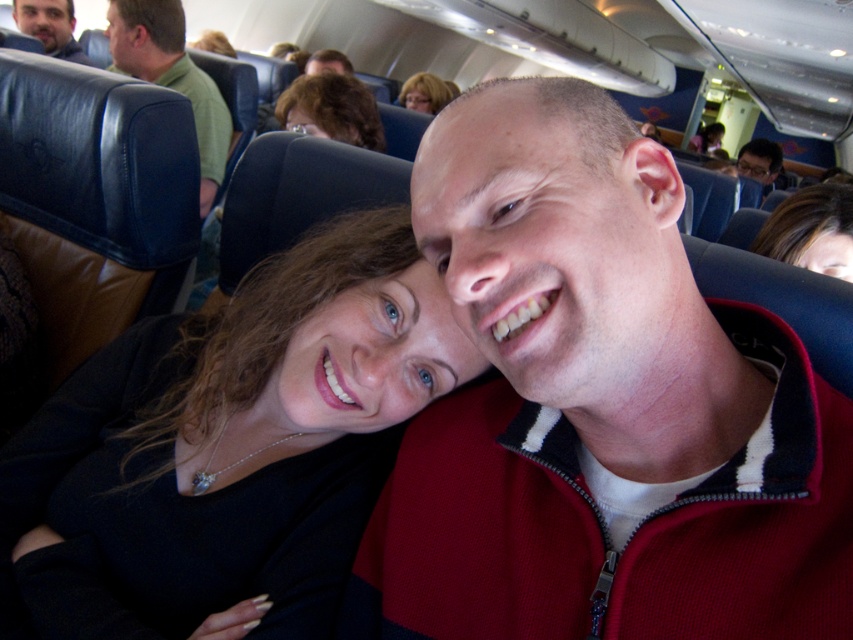
You are a flight attendant and need to locate the black matte sweater at center for a passenger. According to the coordinates provided, where should you look in the image?

The black matte sweater at center is located at point coordinates of (231,445).

You are seated in the airplane cabin and want to place your black matte sweater at center on the green matte chair at upper left. Can you place it there directly without moving the chair?

The black matte sweater at center is already positioned on the right side of the green matte chair at upper left, so you can place it there directly without moving the chair.